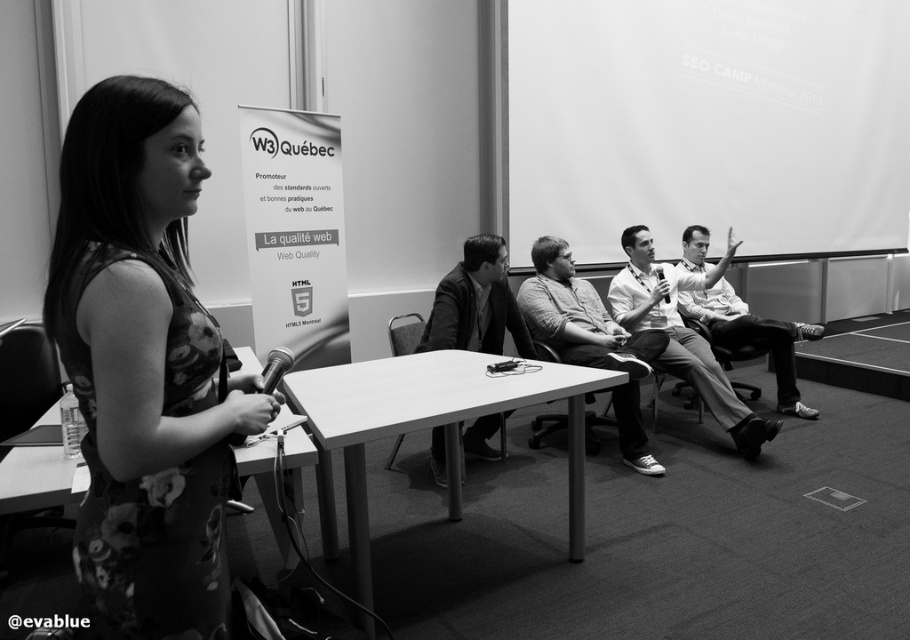
Question: Is matte gray shirt at center thinner than metallic silver microphone at center?

Choices:
 (A) yes
 (B) no

Answer: (B)

Question: Among these points, which one is nearest to the camera?

Choices:
 (A) (658, 266)
 (B) (160, 634)

Answer: (B)

Question: Which point is farther to the camera?

Choices:
 (A) smooth wooden table at center
 (B) metallic silver microphone at center
 (C) matte gray shirt at center
 (D) light brown shirt at right

Answer: (B)

Question: Can you confirm if white smooth table at center is positioned above metallic silver microphone at center?

Choices:
 (A) no
 (B) yes

Answer: (A)

Question: Which of the following is the closest to the observer?

Choices:
 (A) light brown shirt at right
 (B) matte gray shirt at center

Answer: (B)

Question: Is floral fabric dress at left wider than light gray shirt at center?

Choices:
 (A) no
 (B) yes

Answer: (A)